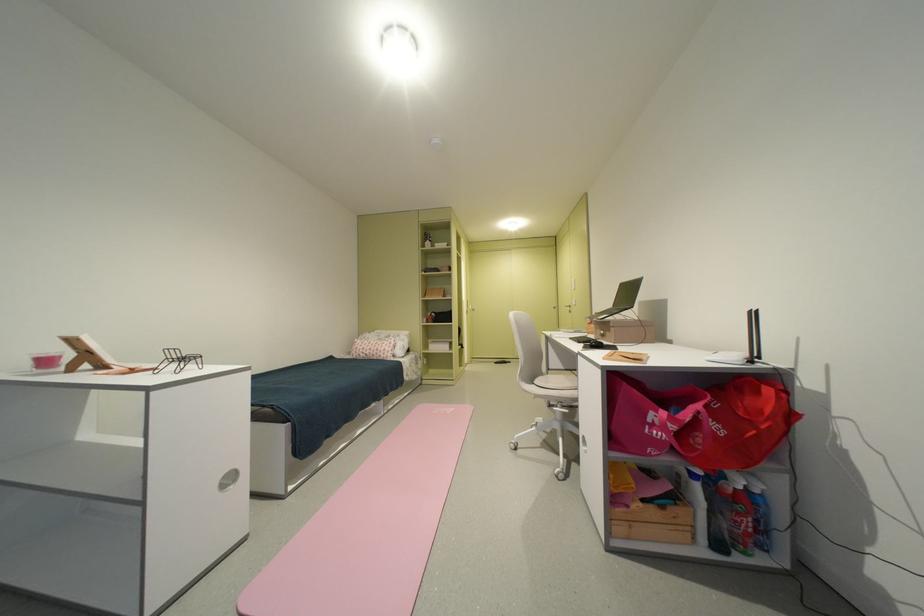
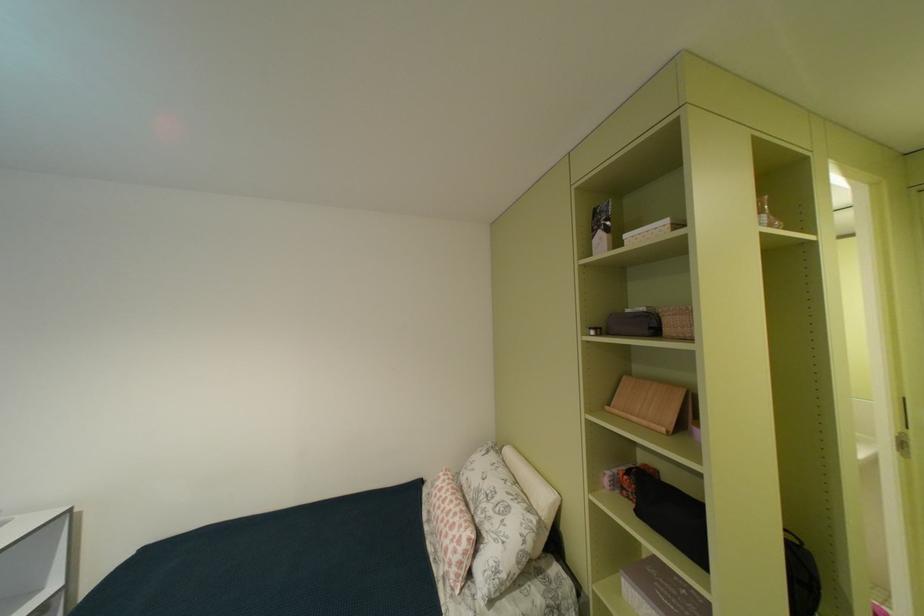
Find the pixel in the second image that matches [396,351] in the first image.

(458, 556)